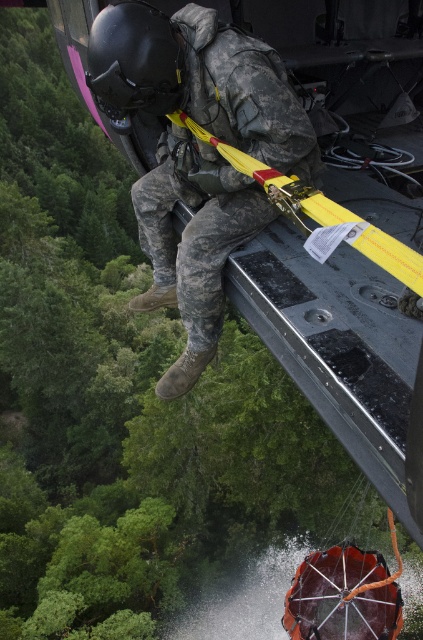
You are a military observer analyzing the parachute jump setup. You notice the camouflage fabric soldier at center and the black matte helmet at upper left. Which object is taller in the image?

The camouflage fabric soldier at center is taller than the black matte helmet at upper left according to the description.

You are a military observer analyzing the image. You see the camouflage fabric soldier at center and the black matte helmet at upper left. Which object is located to the right of the other?

The camouflage fabric soldier at center is positioned on the right side of black matte helmet at upper left.

You are a military observer analyzing the helicopter jump scene. You notice the camouflage fabric soldier at center and the black matte helmet at upper left. Which object is located lower in the image?

The camouflage fabric soldier at center is positioned under the black matte helmet at upper left, so the camouflage fabric soldier at center is lower in the image.